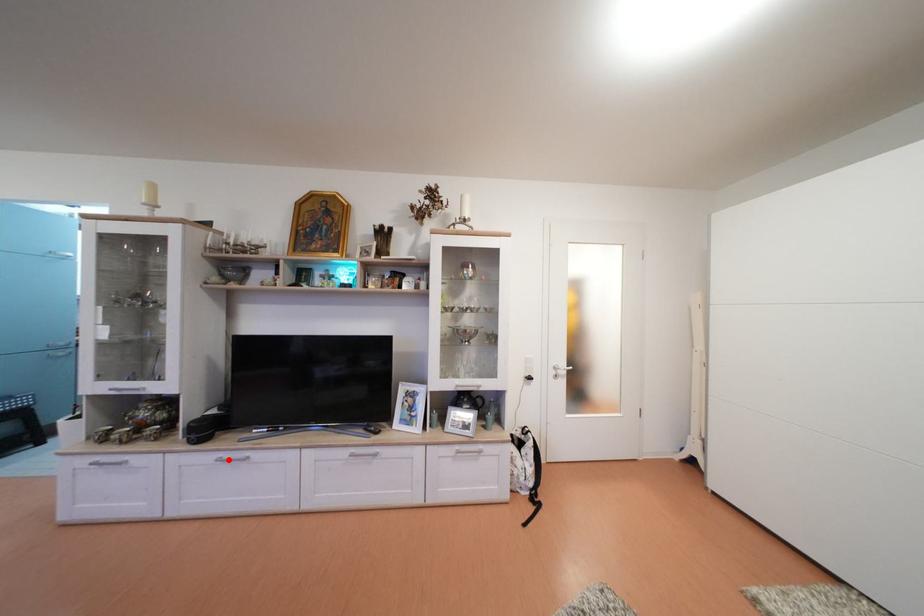
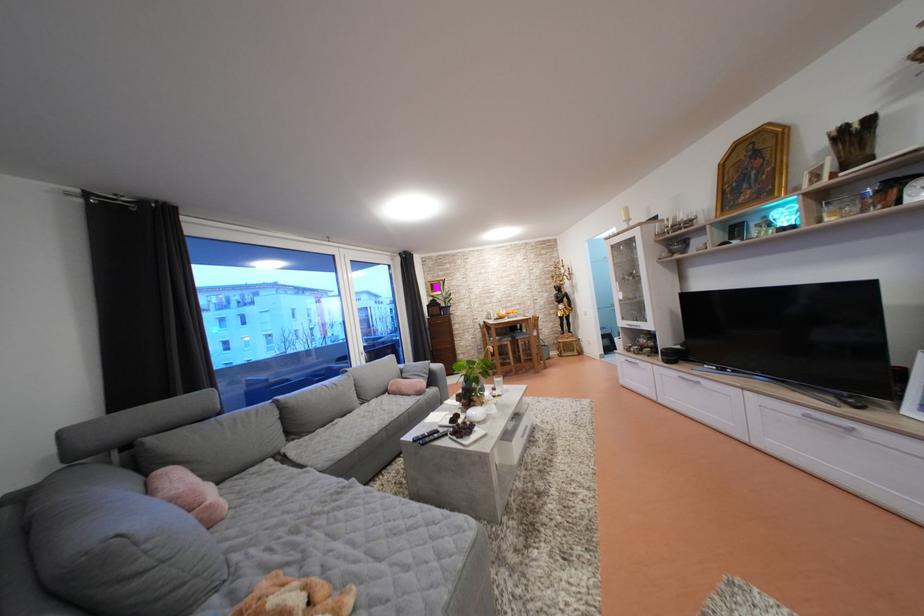
Question: I am providing you with two images of the same scene from different viewpoints. In image1, a red point is highlighted. Considering the same 3D point in image2, which of the following is correct?

Choices:
 (A) It is closer
 (B) It is farther

Answer: (A)